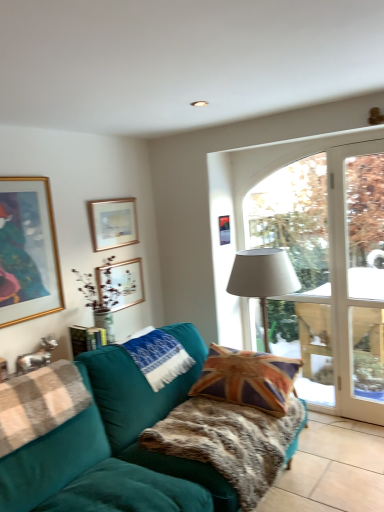
Measure the distance between metallic gold picture frame at upper center, acting as the 4th picture frame starting from the left, and camera.

metallic gold picture frame at upper center, acting as the 4th picture frame starting from the left, is 11.06 feet from camera.

I want to click on white fabric lampshade at center, so 263,278.

What is the approximate width of fur-like teal blanket at center?

It is 28.93 inches.

Locate an element on the screen. The width and height of the screenshot is (384, 512). gold-framed picture at upper left, positioned as the fourth picture frame in right-to-left order is located at coordinates (27, 251).

Identify the location of union jack fabric pillow at center, which appears as the 1th pillow when viewed from the right. This screenshot has height=512, width=384. (248, 379).

The image size is (384, 512). Find the location of `teal velvet couch at lower left`. teal velvet couch at lower left is located at coordinates (114, 443).

Considering the positions of points (154, 352) and (53, 278), is point (154, 352) closer to camera compared to point (53, 278)?

That is True.

From a real-world perspective, does white knitted pillow at center, which appears as the second pillow when viewed from the right, stand above gold-framed picture at upper left, positioned as the fourth picture frame in right-to-left order?

Incorrect, from a real-world perspective, white knitted pillow at center, which appears as the second pillow when viewed from the right, is lower than gold-framed picture at upper left, positioned as the fourth picture frame in right-to-left order.

Can you confirm if white knitted pillow at center, which appears as the first pillow when viewed from the left, is shorter than gold-framed picture at upper left, the first picture frame positioned from the left?

Indeed, white knitted pillow at center, which appears as the first pillow when viewed from the left, has a lesser height compared to gold-framed picture at upper left, the first picture frame positioned from the left.

Does point (372, 238) appear closer or farther from the camera than point (236, 451)?

Clearly, point (372, 238) is more distant from the camera than point (236, 451).

How many degrees apart are the facing directions of white glass door at right and fur-like teal blanket at center?

The facing directions of white glass door at right and fur-like teal blanket at center are 90.3 degrees apart.

From the image's perspective, which is above, white glass door at right or fur-like teal blanket at center?

white glass door at right is shown above in the image.

Where is `window frame above the fur-like teal blanket at center (from a real-world perspective)`? This screenshot has width=384, height=512. window frame above the fur-like teal blanket at center (from a real-world perspective) is located at coordinates (363, 274).

Locate an element on the screen. This screenshot has width=384, height=512. window above the white knitted pillow at center, which appears as the second pillow when viewed from the right (from the image's perspective) is located at coordinates (329, 273).

Which object is positioned more to the left, transparent glass door at center or white knitted pillow at center, which appears as the first pillow when viewed from the left?

white knitted pillow at center, which appears as the first pillow when viewed from the left, is more to the left.

Which of these two, transparent glass door at center or white knitted pillow at center, which appears as the first pillow when viewed from the left, stands taller?

transparent glass door at center is taller.

From the image's perspective, is transparent glass door at center located above or below white knitted pillow at center, which appears as the second pillow when viewed from the right?

From the image's perspective, transparent glass door at center appears above white knitted pillow at center, which appears as the second pillow when viewed from the right.

Which is less distant, (184,354) or (203,382)?

The point (203,382) is closer.

Is union jack fabric pillow at center, the 2th pillow in the left-to-right sequence, at the back of white knitted pillow at center, which appears as the first pillow when viewed from the left?

That's not correct — white knitted pillow at center, which appears as the first pillow when viewed from the left, is not looking away from union jack fabric pillow at center, the 2th pillow in the left-to-right sequence.

Between white knitted pillow at center, which appears as the second pillow when viewed from the right, and union jack fabric pillow at center, which appears as the 1th pillow when viewed from the right, which one has larger width?

union jack fabric pillow at center, which appears as the 1th pillow when viewed from the right, is wider.

From the image's perspective, which object appears higher, white knitted pillow at center, which appears as the first pillow when viewed from the left, or union jack fabric pillow at center, which appears as the 1th pillow when viewed from the right?

white knitted pillow at center, which appears as the first pillow when viewed from the left, appears higher in the image.

In the scene shown: Which point is more forward, (42, 304) or (289, 266)?

The point (289, 266) is closer to the camera.

Could you tell me if gold-framed picture at upper left, positioned as the fourth picture frame in right-to-left order, is facing white fabric lampshade at center?

No, gold-framed picture at upper left, positioned as the fourth picture frame in right-to-left order, is not facing towards white fabric lampshade at center.

From the image's perspective, who appears lower, gold-framed picture at upper left, positioned as the fourth picture frame in right-to-left order, or white fabric lampshade at center?

white fabric lampshade at center.

Find the location of a particular element. table lamp that is below the gold-framed picture at upper left, positioned as the fourth picture frame in right-to-left order (from the image's perspective) is located at coordinates click(263, 278).

Is gold-framed picture at upper left, positioned as the fourth picture frame in right-to-left order, bigger or smaller than matte gold picture frame at upper center, which is counted as the 2th picture frame, starting from the left?

In the image, gold-framed picture at upper left, positioned as the fourth picture frame in right-to-left order, appears to be larger than matte gold picture frame at upper center, which is counted as the 2th picture frame, starting from the left.

From a real-world perspective, is gold-framed picture at upper left, positioned as the fourth picture frame in right-to-left order, positioned under matte gold picture frame at upper center, which is counted as the 2th picture frame, starting from the left, based on gravity?

Yes, from a real-world perspective, gold-framed picture at upper left, positioned as the fourth picture frame in right-to-left order, is under matte gold picture frame at upper center, which is counted as the 2th picture frame, starting from the left.

Is gold-framed picture at upper left, the first picture frame positioned from the left, thinner than matte gold picture frame at upper center, the 3th picture frame positioned from the right?

In fact, gold-framed picture at upper left, the first picture frame positioned from the left, might be wider than matte gold picture frame at upper center, the 3th picture frame positioned from the right.

Is there a large distance between gold-framed picture at upper left, positioned as the fourth picture frame in right-to-left order, and matte gold picture frame at upper center, the 3th picture frame positioned from the right?

No, gold-framed picture at upper left, positioned as the fourth picture frame in right-to-left order, is in close proximity to matte gold picture frame at upper center, the 3th picture frame positioned from the right.

From the image's perspective, is matte gold picture frame at upper center, which is counted as the 2th picture frame, starting from the left, located above teal velvet couch at lower left?

Correct, matte gold picture frame at upper center, which is counted as the 2th picture frame, starting from the left, appears higher than teal velvet couch at lower left in the image.

Can you tell me how much matte gold picture frame at upper center, the 3th picture frame positioned from the right, and teal velvet couch at lower left differ in facing direction?

The facing directions of matte gold picture frame at upper center, the 3th picture frame positioned from the right, and teal velvet couch at lower left are 0.142 degrees apart.

Is point (126, 226) farther from camera compared to point (176, 383)?

Yes, point (126, 226) is behind point (176, 383).

From a real-world perspective, is matte gold picture frame at upper center, the 3th picture frame positioned from the right, beneath teal velvet couch at lower left?

No.

Starting from the gold-framed picture at upper left, the first picture frame positioned from the left, which pillow is the 1st one to the right? Please provide its 2D coordinates.

[(159, 357)]

Find the location of a particular element. The image size is (384, 512). window frame that is behind the fur-like teal blanket at center is located at coordinates [363, 274].

From the image, which object appears to be nearer to white knitted pillow at center, which appears as the second pillow when viewed from the right, matte gold picture frame at upper left, marked as the second picture frame in a right-to-left arrangement, or white fabric lampshade at center?

white fabric lampshade at center lies closer to white knitted pillow at center, which appears as the second pillow when viewed from the right, than the other object.

When comparing their distances from union jack fabric pillow at center, the 2th pillow in the left-to-right sequence, does matte gold picture frame at upper center, the 3th picture frame positioned from the right, or matte gold picture frame at upper left, marked as the second picture frame in a right-to-left arrangement, seem closer?

matte gold picture frame at upper left, marked as the second picture frame in a right-to-left arrangement, is closer to union jack fabric pillow at center, the 2th pillow in the left-to-right sequence.

Consider the image. Looking at the image, which one is located further to metallic gold picture frame at upper center, placed as the 1th picture frame when sorted from right to left, gold-framed picture at upper left, positioned as the fourth picture frame in right-to-left order, or white knitted pillow at center, which appears as the first pillow when viewed from the left?

gold-framed picture at upper left, positioned as the fourth picture frame in right-to-left order, is positioned further to the anchor metallic gold picture frame at upper center, placed as the 1th picture frame when sorted from right to left.

Which object lies nearer to the anchor point white glass door at right, gold-framed picture at upper left, positioned as the fourth picture frame in right-to-left order, or white knitted pillow at center, which appears as the first pillow when viewed from the left?

white knitted pillow at center, which appears as the first pillow when viewed from the left.

Based on their spatial positions, is matte gold picture frame at upper center, the 3th picture frame positioned from the right, or transparent glass door at center closer to union jack fabric pillow at center, which appears as the 1th pillow when viewed from the right?

The object closer to union jack fabric pillow at center, which appears as the 1th pillow when viewed from the right, is transparent glass door at center.

Considering their positions, is matte gold picture frame at upper left, marked as the second picture frame in a right-to-left arrangement, positioned closer to white glass door at right than fur-like teal blanket at center?

fur-like teal blanket at center is positioned closer to the anchor white glass door at right.

Consider the image. Based on their spatial positions, is white fabric lampshade at center or white knitted pillow at center, which appears as the first pillow when viewed from the left, closer to matte gold picture frame at upper center, which is counted as the 2th picture frame, starting from the left?

white knitted pillow at center, which appears as the first pillow when viewed from the left, is positioned closer to the anchor matte gold picture frame at upper center, which is counted as the 2th picture frame, starting from the left.

Considering their positions, is matte gold picture frame at upper center, the 3th picture frame positioned from the right, positioned closer to metallic gold picture frame at upper center, placed as the 1th picture frame when sorted from right to left, than teal velvet couch at lower left?

Among the two, matte gold picture frame at upper center, the 3th picture frame positioned from the right, is located nearer to metallic gold picture frame at upper center, placed as the 1th picture frame when sorted from right to left.

This screenshot has height=512, width=384. In order to click on table lamp situated between matte gold picture frame at upper center, the 3th picture frame positioned from the right, and white glass door at right from left to right in this screenshot , I will do `click(263, 278)`.

Image resolution: width=384 pixels, height=512 pixels. I want to click on window frame between teal velvet couch at lower left and matte gold picture frame at upper center, the 3th picture frame positioned from the right, in the front-back direction, so click(x=363, y=274).

Identify the location of picture frame located between gold-framed picture at upper left, the first picture frame positioned from the left, and matte gold picture frame at upper left, marked as the second picture frame in a right-to-left arrangement, in the depth direction. Image resolution: width=384 pixels, height=512 pixels. (113, 223).

Where is `table lamp between matte gold picture frame at upper left, acting as the 3th picture frame starting from the left, and white glass door at right, in the horizontal direction`? table lamp between matte gold picture frame at upper left, acting as the 3th picture frame starting from the left, and white glass door at right, in the horizontal direction is located at coordinates (263, 278).